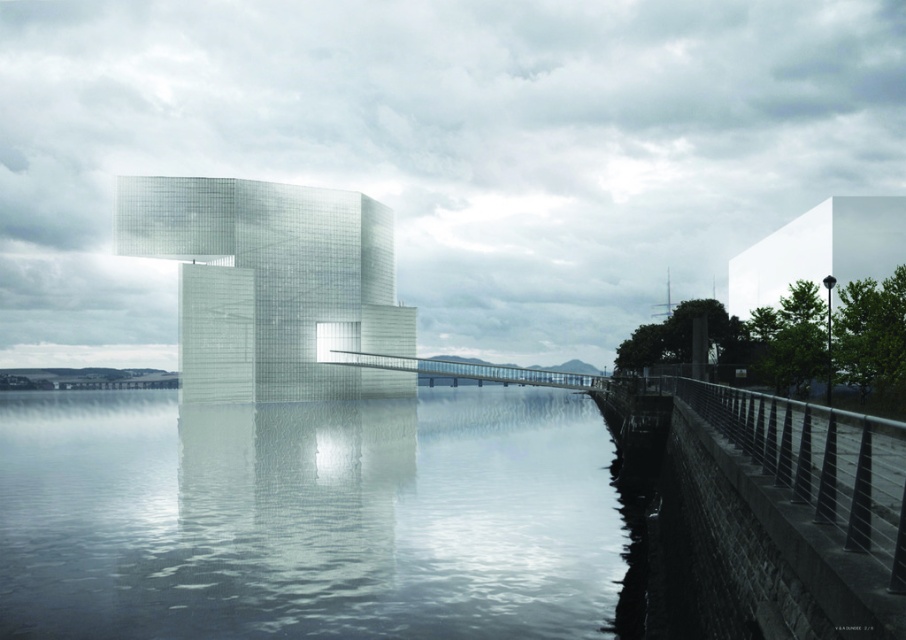
Between point (398, 529) and point (323, 352), which one is positioned behind?

The point (323, 352) is more distant.

Measure the distance between transparent glass water at lower center and camera.

transparent glass water at lower center is 17.64 meters from camera.

Locate an element on the screen. transparent glass water at lower center is located at coordinates (310, 518).